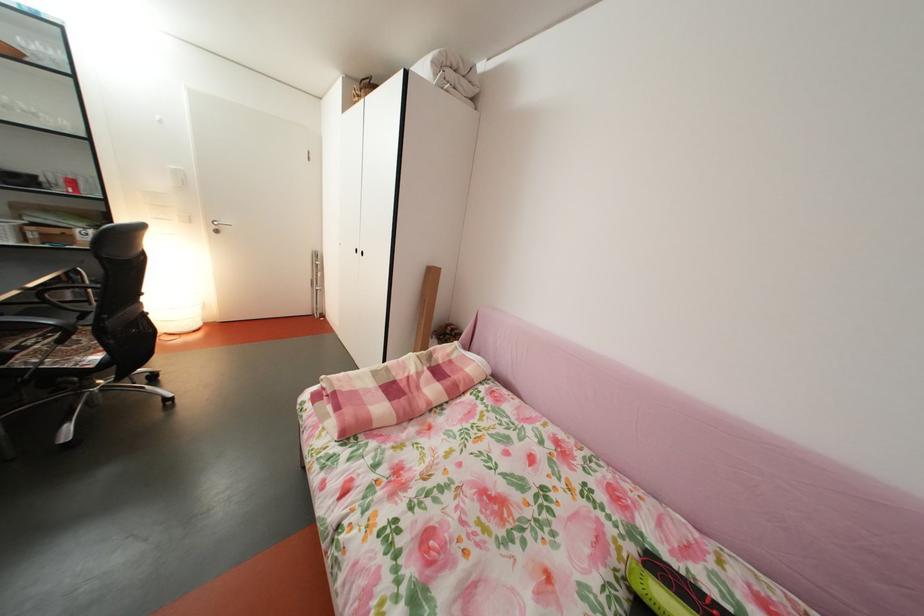
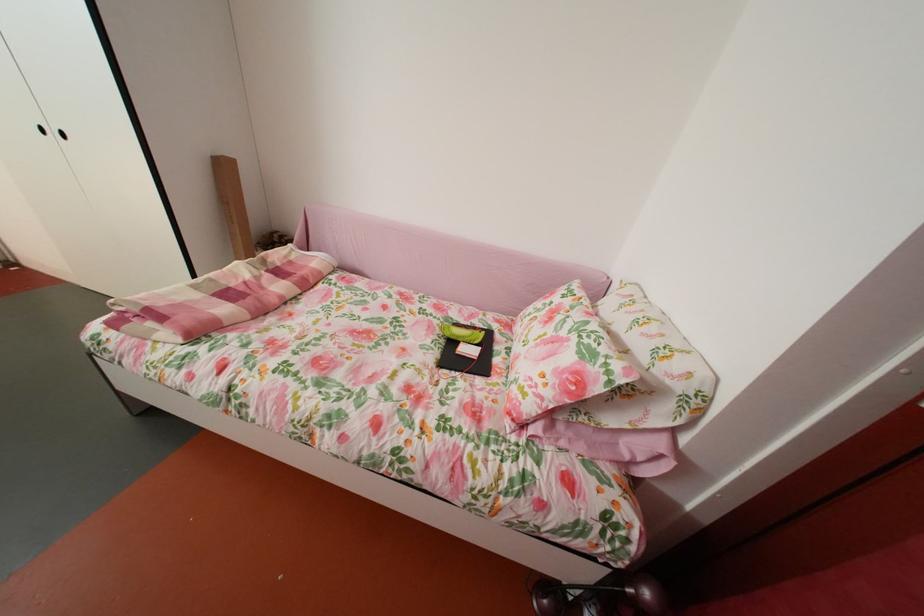
Find the pixel in the second image that matches (x=371, y=257) in the first image.

(65, 139)